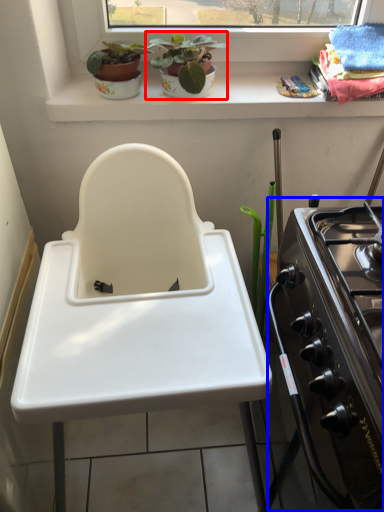
Question: Which of the following is the closest to the observer, houseplant (highlighted by a red box) or oven (highlighted by a blue box)?

Choices:
 (A) houseplant
 (B) oven

Answer: (B)